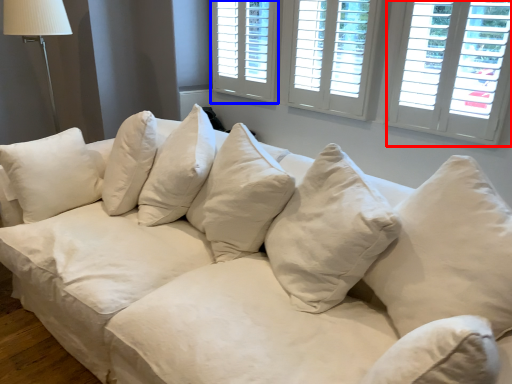
Question: Which object is further to the camera taking this photo, window (highlighted by a red box) or window (highlighted by a blue box)?

Choices:
 (A) window
 (B) window

Answer: (B)